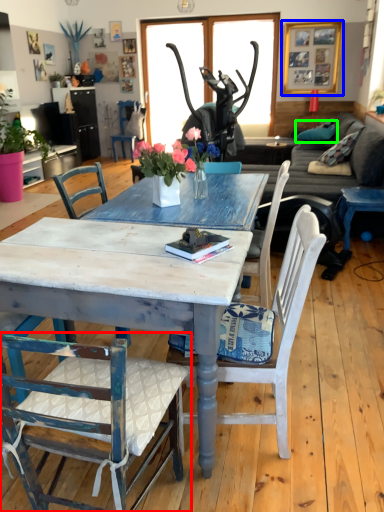
Question: Which object is positioned farthest from chair (highlighted by a red box)? Select from picture frame (highlighted by a blue box) and pillow (highlighted by a green box).

Choices:
 (A) picture frame
 (B) pillow

Answer: (A)